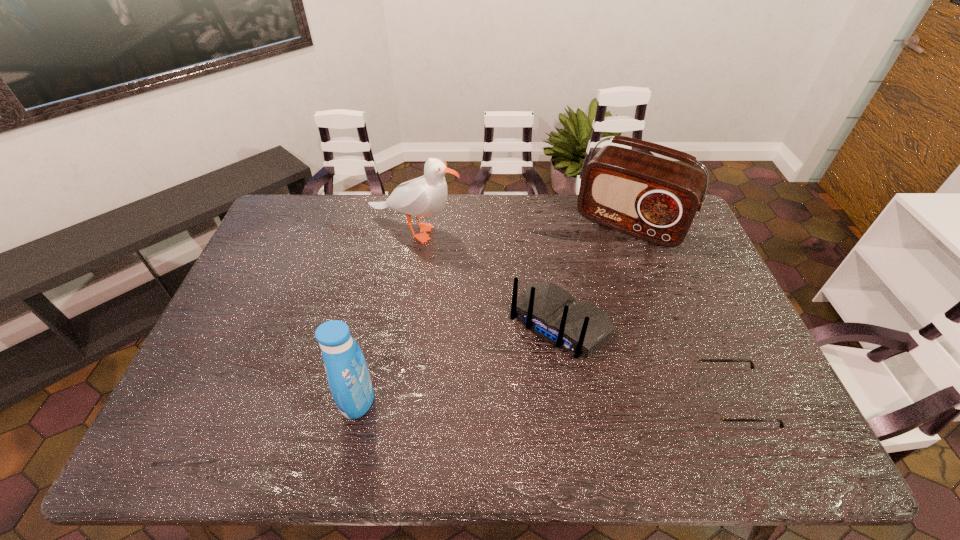
At what (x,y) coordinates should I click in order to perform the action: click on free region at the near edge. Please return your answer as a coordinate pair (x, y). Image resolution: width=960 pixels, height=540 pixels. Looking at the image, I should click on (527, 388).

Identify the location of free region at the right edge of the desktop. click(x=694, y=332).

Image resolution: width=960 pixels, height=540 pixels. Identify the location of vacant space at the near left corner. (236, 397).

Locate an element on the screen. The width and height of the screenshot is (960, 540). free spot between the gull and the detergent is located at coordinates (387, 315).

What are the coordinates of `free spot between the third nearest object and the detergent` in the screenshot? It's located at (459, 362).

I want to click on vacant point located between the radio receiver and the detergent, so click(x=494, y=312).

Find the location of `vacant region between the radio receiver and the gull`. vacant region between the radio receiver and the gull is located at coordinates (522, 227).

The image size is (960, 540). I want to click on vacant space that is in between the fourth tallest object and the detergent, so click(x=459, y=362).

This screenshot has width=960, height=540. Identify the location of vacant space that's between the gull and the radio receiver. (522, 227).

I want to click on vacant area between the detergent and the radio receiver, so click(x=494, y=312).